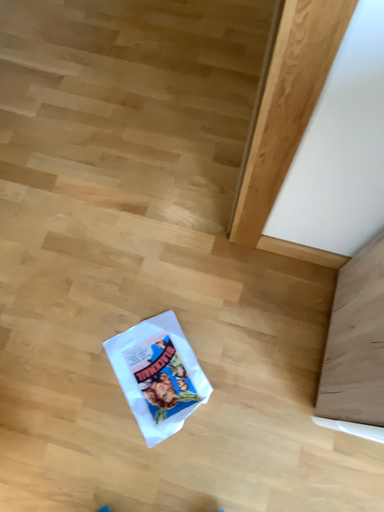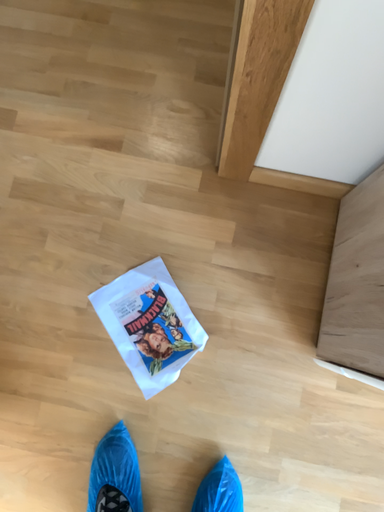
Question: How did the camera likely rotate when shooting the video?

Choices:
 (A) rotated downward
 (B) rotated upward

Answer: (A)